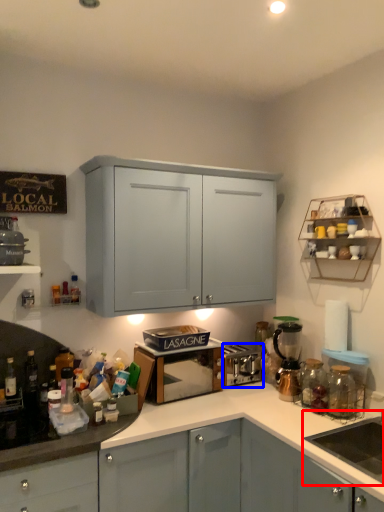
Question: Which point is closer to the camera, sink (highlighted by a red box) or appliance (highlighted by a blue box)?

Choices:
 (A) sink
 (B) appliance

Answer: (A)